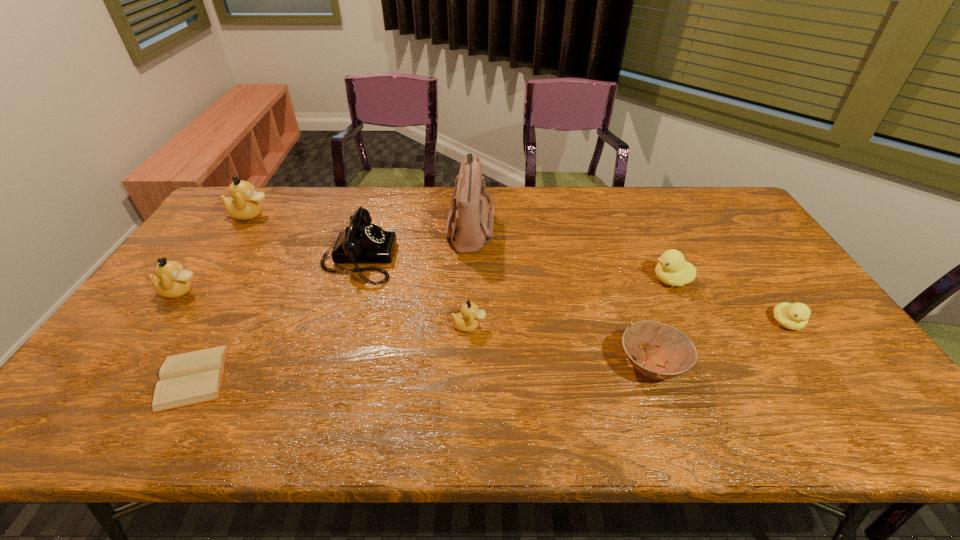
The image size is (960, 540). In order to click on blank space located at the beak of the second duckling from right to left in this screenshot , I will do `click(610, 280)`.

Locate an element on the screen. vacant space situated 0.270m at the beak of the second duckling from right to left is located at coordinates (559, 280).

Where is `vacant space located on the face of the smallest tan duckling`? vacant space located on the face of the smallest tan duckling is located at coordinates (528, 326).

Where is `vacant region located 0.050m at the beak of the smaller yellow duckling`? vacant region located 0.050m at the beak of the smaller yellow duckling is located at coordinates (806, 351).

Identify the location of free location located on the left of the bowl. (543, 365).

The width and height of the screenshot is (960, 540). Identify the location of vacant space located 0.270m on the right of the diary. (344, 376).

At what (x,y) coordinates should I click in order to perform the action: click on shoulder bag that is positioned at the far edge. Please return your answer as a coordinate pair (x, y). Looking at the image, I should click on (469, 226).

Locate an element on the screen. This screenshot has height=540, width=960. duckling at the far edge is located at coordinates (243, 204).

Identify the location of object that is at the near edge. Image resolution: width=960 pixels, height=540 pixels. (193, 377).

Where is `diary that is at the left edge`? The width and height of the screenshot is (960, 540). diary that is at the left edge is located at coordinates (193, 377).